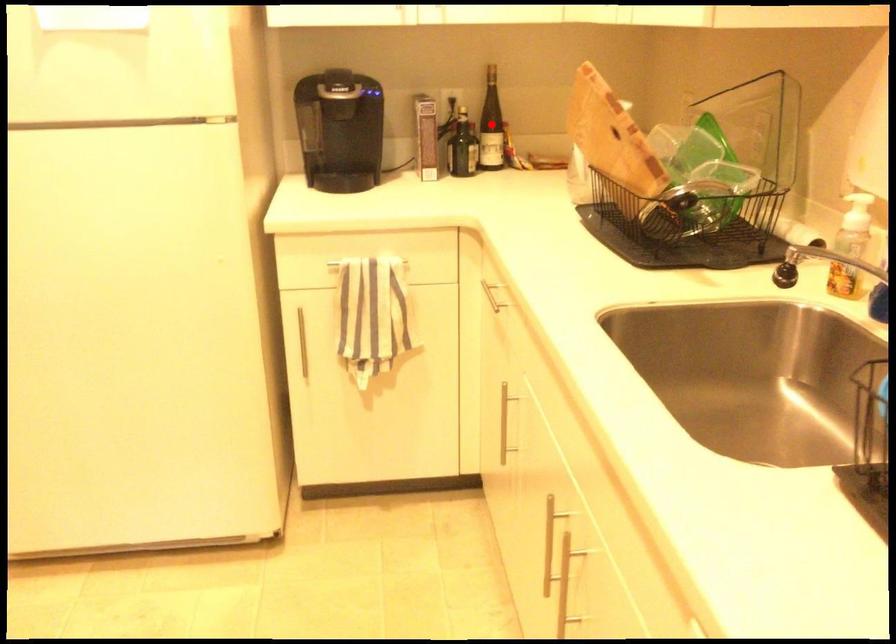
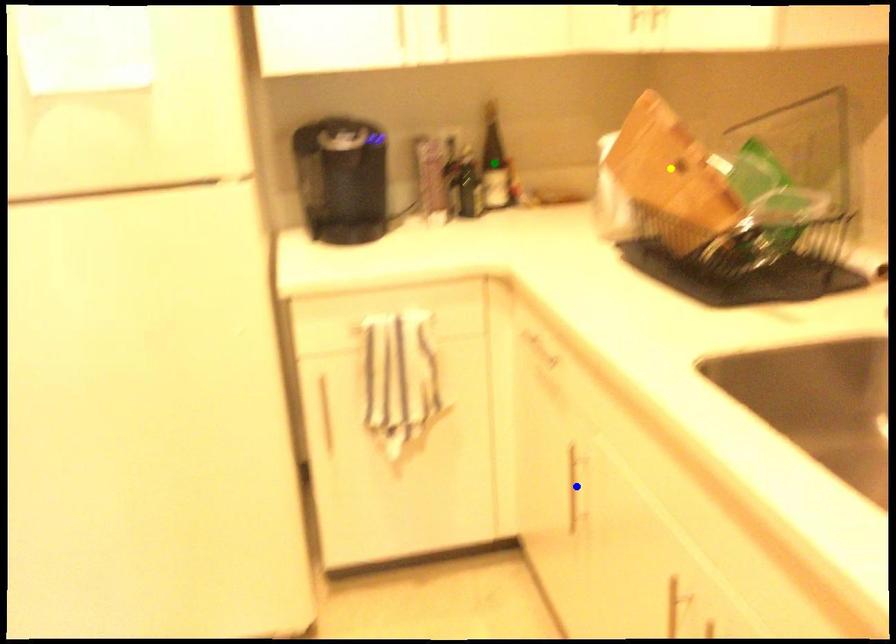
Question: I am providing you with two images of the same scene from different viewpoints. A red point is marked on the first image. You are given multiple points on the second image. Which point in image 2 represents the same 3d spot as the red point in image 1?

Choices:
 (A) blue point
 (B) green point
 (C) yellow point

Answer: (B)